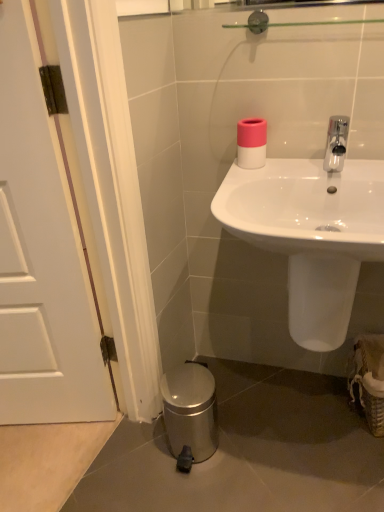
The height and width of the screenshot is (512, 384). Find the location of `vacant region to the left of white matte door at left`. vacant region to the left of white matte door at left is located at coordinates (50, 468).